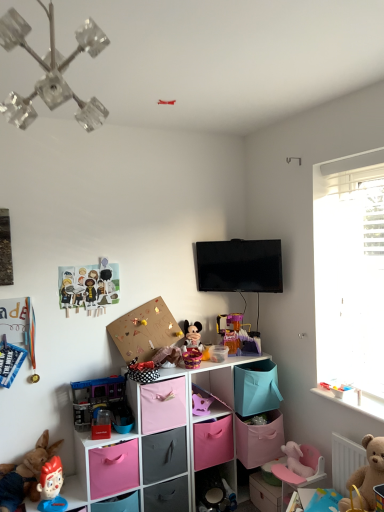
The width and height of the screenshot is (384, 512). I want to click on vacant space in front of wooden toy at upper center, placed as the 10th toy when sorted from bottom to top, so click(x=152, y=93).